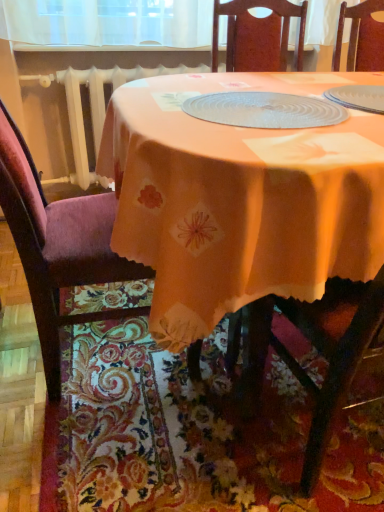
Describe the element at coordinates (240, 199) in the screenshot. I see `orange fabric table at center` at that location.

Identify the location of velvet purple chair at left. The height and width of the screenshot is (512, 384). (58, 246).

Image resolution: width=384 pixels, height=512 pixels. What are the coordinates of `place mat that appears behind the orange fabric table at center` in the screenshot? It's located at (190, 433).

Could you tell me if orange fabric table at center is facing orange fabric placemat at lower center?

No, orange fabric table at center is not turned towards orange fabric placemat at lower center.

Are orange fabric table at center and orange fabric placemat at lower center beside each other?

No, orange fabric table at center is not beside orange fabric placemat at lower center.

From the picture: How different are the orientations of orange fabric table at center and orange fabric placemat at lower center in degrees?

1.2 degrees.

Considering the sizes of objects velvet purple chair at left and orange fabric table at center in the image provided, who is bigger, velvet purple chair at left or orange fabric table at center?

With larger size is orange fabric table at center.

Considering the points (31, 294) and (157, 96), which point is in front, point (31, 294) or point (157, 96)?

Positioned in front is point (31, 294).

Is orange fabric table at center located within velvet purple chair at left?

No, velvet purple chair at left does not contain orange fabric table at center.

This screenshot has width=384, height=512. Find the location of `table below the velvet purple chair at left (from the image's perspective)`. table below the velvet purple chair at left (from the image's perspective) is located at coordinates 240,199.

Are orange fabric table at center and velvet purple chair at left beside each other?

No, orange fabric table at center is not making contact with velvet purple chair at left.

Is orange fabric table at center aimed at velvet purple chair at left?

No, orange fabric table at center is not aimed at velvet purple chair at left.

Can velvet purple chair at left be found inside orange fabric table at center?

Yes, velvet purple chair at left is inside orange fabric table at center.

Is orange fabric placemat at lower center spatially inside velvet purple chair at left, or outside of it?

orange fabric placemat at lower center is not inside velvet purple chair at left, it's outside.

Looking at this image, from the image's perspective, who appears lower, orange fabric placemat at lower center or velvet purple chair at left?

orange fabric placemat at lower center, from the image's perspective.

Relative to velvet purple chair at left, is orange fabric placemat at lower center in front or behind?

Visually, orange fabric placemat at lower center is located behind velvet purple chair at left.

Is orange fabric placemat at lower center at the left side of velvet purple chair at left?

No, orange fabric placemat at lower center is not to the left of velvet purple chair at left.

Based on their sizes in the image, would you say clear plastic placemat at center is bigger or smaller than orange fabric table at center?

Clearly, clear plastic placemat at center is smaller in size than orange fabric table at center.

Which object is wider, clear plastic placemat at center or orange fabric table at center?

orange fabric table at center.

From a real-world perspective, which object rests below the other?

In real-world perspective, orange fabric table at center is lower.

How much distance is there between clear plastic placemat at center and orange fabric table at center?

clear plastic placemat at center and orange fabric table at center are 6.74 inches apart.

Is clear plastic placemat at center far from velvet purple chair at left?

clear plastic placemat at center is actually quite close to velvet purple chair at left.

Which of these two, clear plastic placemat at center or velvet purple chair at left, is thinner?

clear plastic placemat at center is thinner.

Consider the image. Considering the sizes of clear plastic placemat at center and velvet purple chair at left in the image, is clear plastic placemat at center taller or shorter than velvet purple chair at left?

Considering their sizes, clear plastic placemat at center has less height than velvet purple chair at left.

Is clear plastic placemat at center further to camera compared to velvet purple chair at left?

Yes, the depth of clear plastic placemat at center is greater than that of velvet purple chair at left.

From the image's perspective, which is above, orange fabric placemat at lower center or clear plastic placemat at center?

clear plastic placemat at center.

From a real-world perspective, is orange fabric placemat at lower center over clear plastic placemat at center?

No, from a real-world perspective, orange fabric placemat at lower center is not above clear plastic placemat at center.

Is the depth of orange fabric placemat at lower center less than that of clear plastic placemat at center?

Yes.

Identify the location of place mat below the orange fabric table at center (from a real-world perspective). This screenshot has height=512, width=384. (190, 433).

You are a GUI agent. You are given a task and a screenshot of the screen. Output one action in this format:
    pyautogui.click(x=<x>, y=<y>)
    Task: Click on the chair above the orange fabric table at center (from a real-world perspective)
    
    Given the screenshot: What is the action you would take?
    pyautogui.click(x=58, y=246)

From the image, which object appears to be farther from clear plastic placemat at center, orange fabric table at center or orange fabric placemat at lower center?

orange fabric placemat at lower center lies further to clear plastic placemat at center than the other object.

Looking at this image, estimate the real-world distances between objects in this image. Which object is further from orange fabric table at center, velvet purple chair at left or orange fabric placemat at lower center?

orange fabric placemat at lower center lies further to orange fabric table at center than the other object.

From the image, which object appears to be farther from orange fabric placemat at lower center, clear plastic placemat at center or velvet purple chair at left?

clear plastic placemat at center lies further to orange fabric placemat at lower center than the other object.

Estimate the real-world distances between objects in this image. Which object is further from orange fabric placemat at lower center, clear plastic placemat at center or orange fabric table at center?

Among the two, clear plastic placemat at center is located further to orange fabric placemat at lower center.

Looking at the image, which one is located closer to orange fabric table at center, clear plastic placemat at center or orange fabric placemat at lower center?

Among the two, clear plastic placemat at center is located nearer to orange fabric table at center.

Considering their positions, is velvet purple chair at left positioned closer to orange fabric placemat at lower center than clear plastic placemat at center?

Among the two, velvet purple chair at left is located nearer to orange fabric placemat at lower center.

In the scene shown: Based on their spatial positions, is orange fabric placemat at lower center or clear plastic placemat at center further from orange fabric table at center?

orange fabric placemat at lower center is positioned further to the anchor orange fabric table at center.

Consider the image. Looking at the image, which one is located closer to orange fabric placemat at lower center, orange fabric table at center or velvet purple chair at left?

velvet purple chair at left is positioned closer to the anchor orange fabric placemat at lower center.

This screenshot has width=384, height=512. I want to click on table that lies between clear plastic placemat at center and orange fabric placemat at lower center from top to bottom, so click(240, 199).

Where is `place mat between velvet purple chair at left and orange fabric table at center from left to right`? place mat between velvet purple chair at left and orange fabric table at center from left to right is located at coordinates (190, 433).

Identify the location of chair between clear plastic placemat at center and orange fabric placemat at lower center from top to bottom. pyautogui.click(x=58, y=246).

At what (x,y) coordinates should I click in order to perform the action: click on tableware between velvet purple chair at left and orange fabric table at center from left to right. Please return your answer as a coordinate pair (x, y). Looking at the image, I should click on (265, 110).